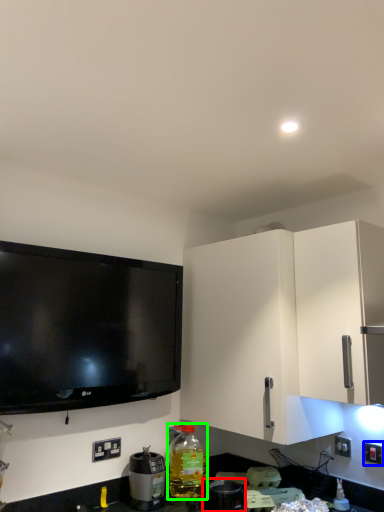
Question: Considering the real-world distances, which object is farthest from appliance (highlighted by a red box)? electric outlet (highlighted by a blue box) or bottle (highlighted by a green box)?

Choices:
 (A) electric outlet
 (B) bottle

Answer: (A)